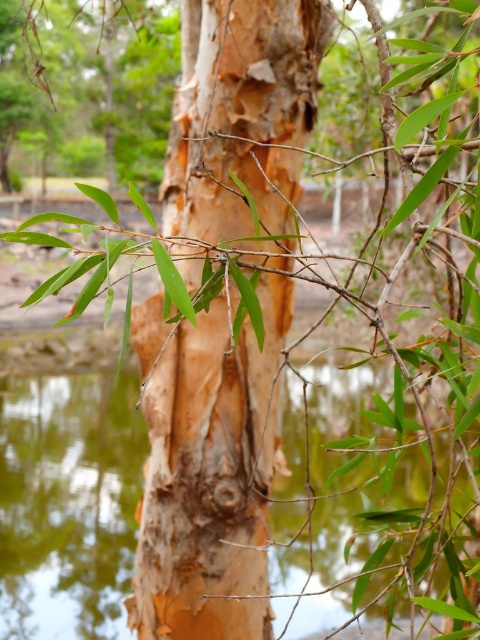
Question: Which point is farther from the camera taking this photo?

Choices:
 (A) (241, 412)
 (B) (328, 506)

Answer: (B)

Question: Is smooth brown bark at center to the right of green reflective water at center from the viewer's perspective?

Choices:
 (A) no
 (B) yes

Answer: (A)

Question: In this image, where is smooth brown bark at center located relative to green reflective water at center?

Choices:
 (A) right
 (B) left

Answer: (B)

Question: Among these points, which one is nearest to the camera?

Choices:
 (A) (257, 28)
 (B) (343, 380)

Answer: (A)

Question: Can you confirm if smooth brown bark at center is positioned above green reflective water at center?

Choices:
 (A) yes
 (B) no

Answer: (A)

Question: Among these points, which one is farthest from the camera?

Choices:
 (A) (410, 456)
 (B) (213, 243)

Answer: (A)